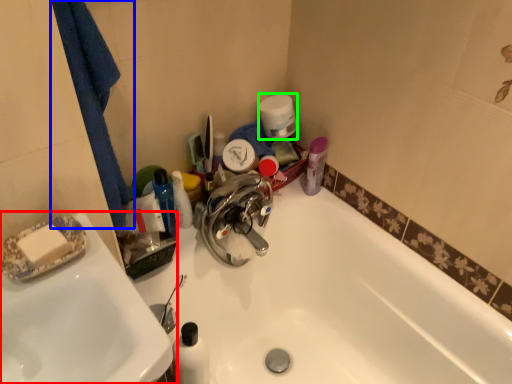
Question: Which object is the farthest from sink (highlighted by a red box)? Choose among these: bath towel (highlighted by a blue box) or toilet paper (highlighted by a green box).

Choices:
 (A) bath towel
 (B) toilet paper

Answer: (B)